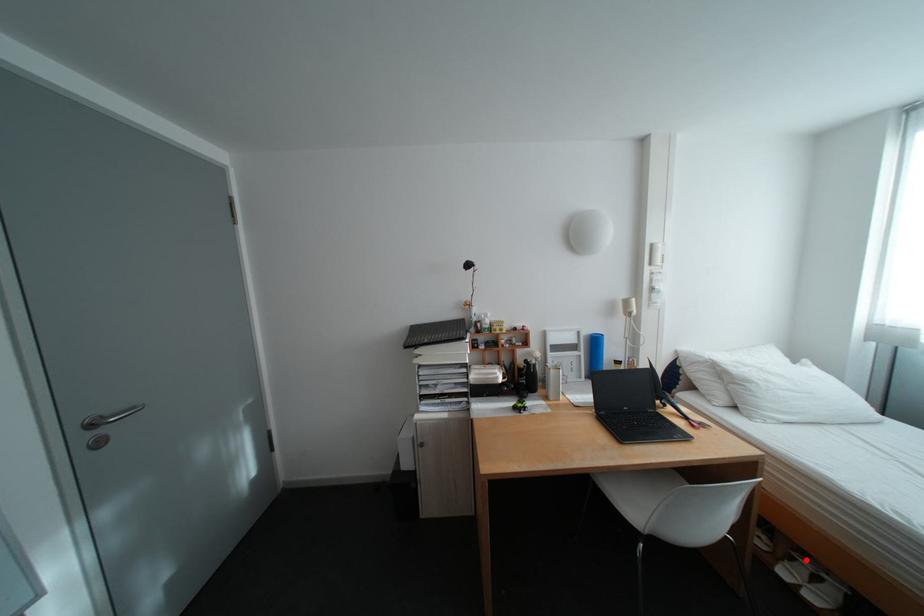
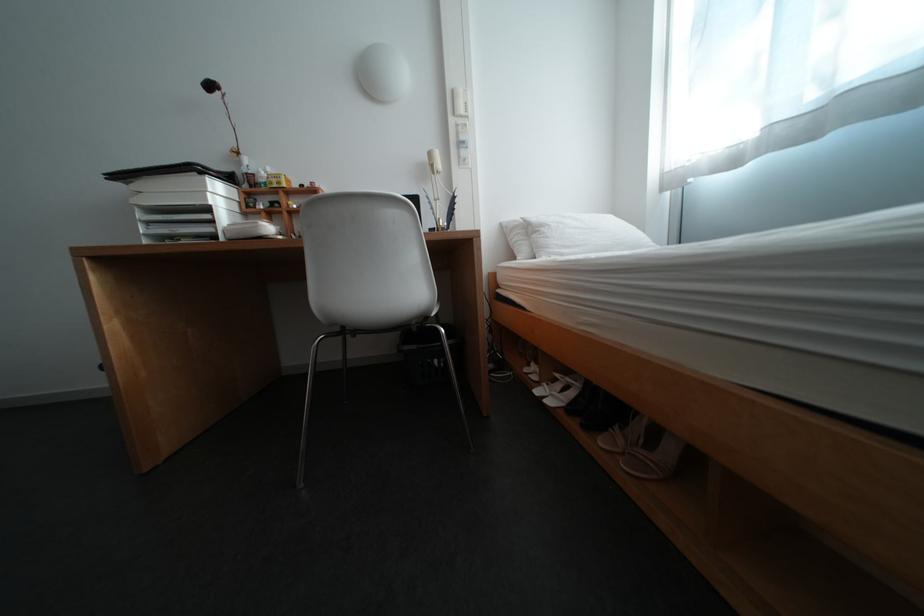
Question: A red point is marked in image1. In image2, is the corresponding 3D point closer to the camera or farther? Reply with the corresponding letter.

Choices:
 (A) The corresponding 3D point is closer.
 (B) The corresponding 3D point is farther.

Answer: (A)